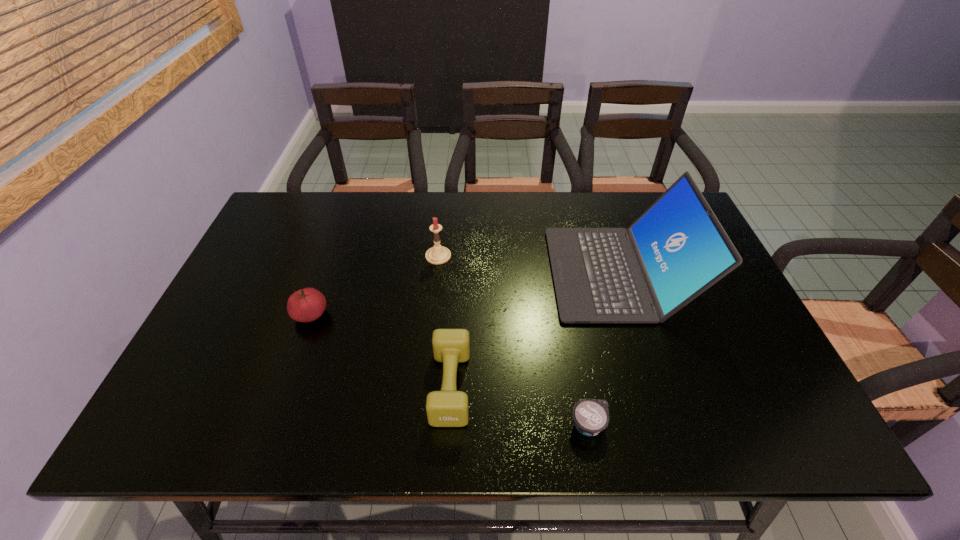
Where is `free location at the far left corner`? The height and width of the screenshot is (540, 960). free location at the far left corner is located at coordinates (297, 214).

The width and height of the screenshot is (960, 540). Identify the location of free location at the near left corner of the desktop. (182, 431).

In the image, there is a desktop. Identify the location of vacant space at the far right corner. (634, 202).

Locate an element on the screen. The width and height of the screenshot is (960, 540). free space between the candle and the laptop computer is located at coordinates (528, 265).

Image resolution: width=960 pixels, height=540 pixels. What are the coordinates of `free spot between the shortest object and the candle` in the screenshot? It's located at (514, 340).

In order to click on unoccupied area between the tomato and the fourth shortest object in this screenshot , I will do `click(374, 286)`.

Find the location of a particular element. The image size is (960, 540). blank region between the candle and the leftmost object is located at coordinates (374, 286).

The width and height of the screenshot is (960, 540). Find the location of `free area in between the fourth shortest object and the dumbbell`. free area in between the fourth shortest object and the dumbbell is located at coordinates (444, 321).

Where is `free space between the shortest object and the second tallest object`? The image size is (960, 540). free space between the shortest object and the second tallest object is located at coordinates (514, 340).

This screenshot has height=540, width=960. In order to click on unoccupied area between the dumbbell and the leftmost object in this screenshot , I will do `click(381, 350)`.